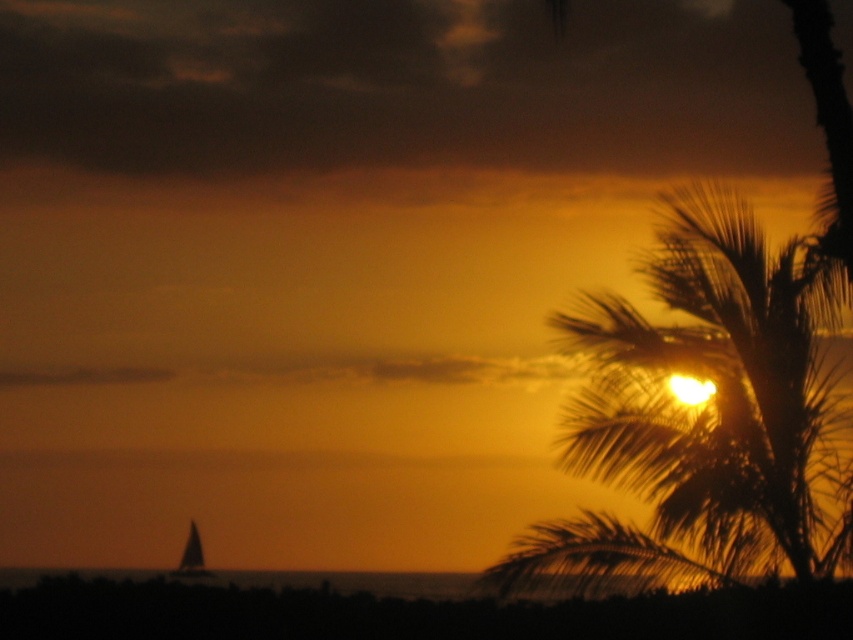
Question: Is silhouette leafy palm at upper right bigger than silvery reflective sailboat at lower left?

Choices:
 (A) yes
 (B) no

Answer: (A)

Question: Among these objects, which one is farthest from the camera?

Choices:
 (A) silvery reflective sailboat at lower left
 (B) silhouette leafy palm at upper right

Answer: (A)

Question: Is silhouette leafy palm at upper right bigger than silvery reflective sailboat at lower left?

Choices:
 (A) yes
 (B) no

Answer: (A)

Question: Which point is farther from the camera taking this photo?

Choices:
 (A) (680, 452)
 (B) (199, 548)

Answer: (B)

Question: Is silhouette leafy palm at upper right bigger than silvery reflective sailboat at lower left?

Choices:
 (A) yes
 (B) no

Answer: (A)

Question: Which of the following is the farthest from the observer?

Choices:
 (A) (183, 576)
 (B) (827, 461)

Answer: (A)